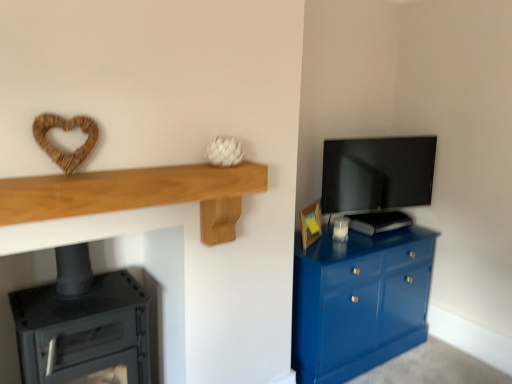
The image size is (512, 384). I want to click on vacant area that is in front of wooden picture frame at right, so click(x=322, y=248).